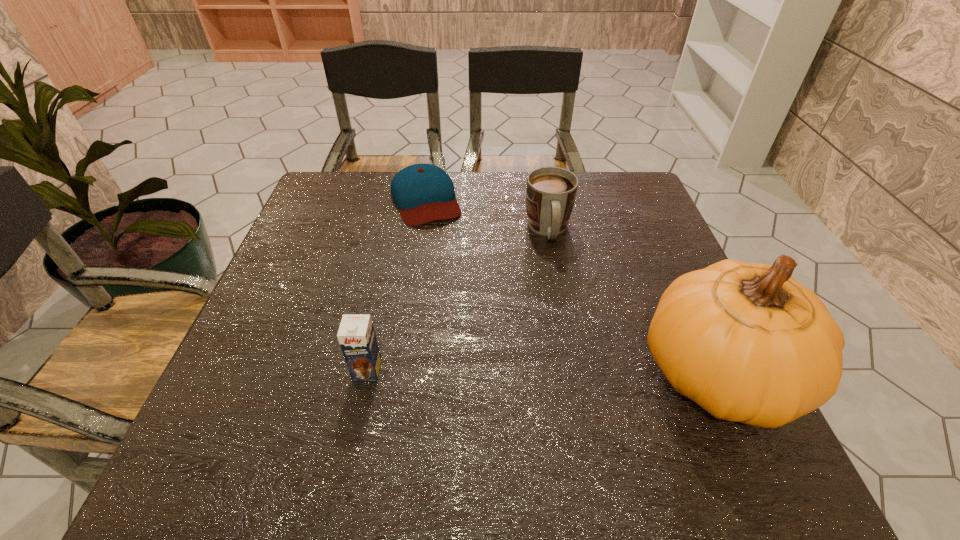
Where is `vacant space at the far right corner of the desktop`? The width and height of the screenshot is (960, 540). vacant space at the far right corner of the desktop is located at coordinates (625, 186).

Locate an element on the screen. The height and width of the screenshot is (540, 960). unoccupied area between the tallest object and the second object from right to left is located at coordinates (632, 302).

Locate an element on the screen. unoccupied area between the chocolate milk and the baseball cap is located at coordinates (396, 285).

Locate an element on the screen. The width and height of the screenshot is (960, 540). vacant region between the shortest object and the chocolate milk is located at coordinates (396, 285).

The width and height of the screenshot is (960, 540). In order to click on vacant area between the shortest object and the chocolate milk in this screenshot , I will do `click(396, 285)`.

Locate an element on the screen. This screenshot has width=960, height=540. free point between the third object from left to right and the shortest object is located at coordinates (487, 215).

The height and width of the screenshot is (540, 960). I want to click on vacant point located between the tallest object and the baseball cap, so click(x=570, y=287).

You are a GUI agent. You are given a task and a screenshot of the screen. Output one action in this format:
    pyautogui.click(x=<x>, y=<y>)
    Task: Click on the vacant area that lies between the rightmost object and the chocolate milk
    
    Given the screenshot: What is the action you would take?
    pyautogui.click(x=541, y=373)

Locate an element on the screen. unoccupied area between the shortest object and the third object from left to right is located at coordinates (487, 215).

At what (x,y) coordinates should I click in order to perform the action: click on free spot between the baseball cap and the rightmost object. Please return your answer as a coordinate pair (x, y). Looking at the image, I should click on (570, 287).